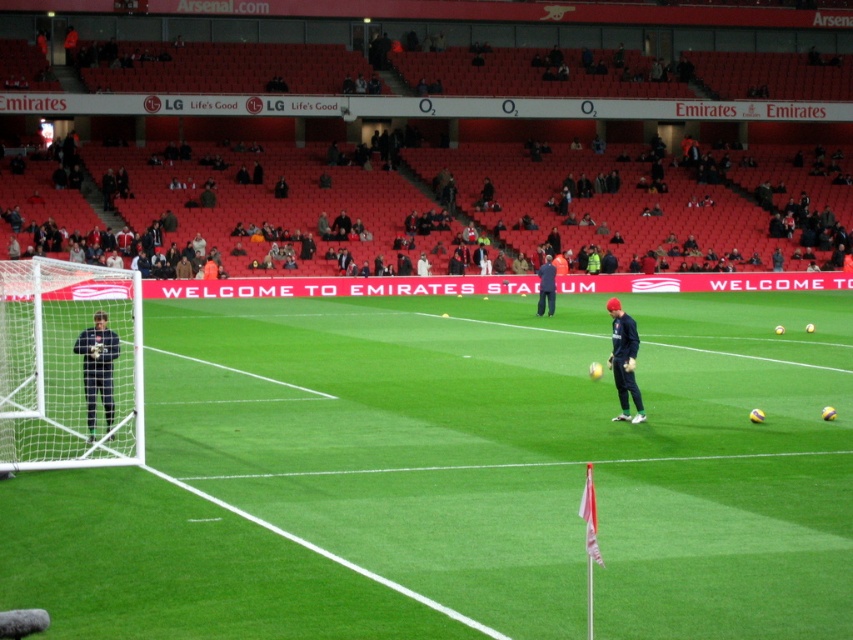
Question: Which object is closer to the camera taking this photo?

Choices:
 (A) dark blue jersey at left
 (B) dark blue jersey at center
 (C) dark blue uniform at center
 (D) green artificial turf at center

Answer: (D)

Question: Which object is farther from the camera taking this photo?

Choices:
 (A) white net at left
 (B) green artificial turf at center

Answer: (A)

Question: Is dark blue tracksuit at center positioned behind dark blue jersey at center?

Choices:
 (A) no
 (B) yes

Answer: (B)

Question: Which point is farther to the camera?

Choices:
 (A) (114, 348)
 (B) (618, 387)

Answer: (B)

Question: Can you confirm if dark blue tracksuit at center is positioned to the left of dark blue jersey at left?

Choices:
 (A) no
 (B) yes

Answer: (A)

Question: Can you confirm if green artificial turf at center is wider than dark blue tracksuit at center?

Choices:
 (A) yes
 (B) no

Answer: (B)